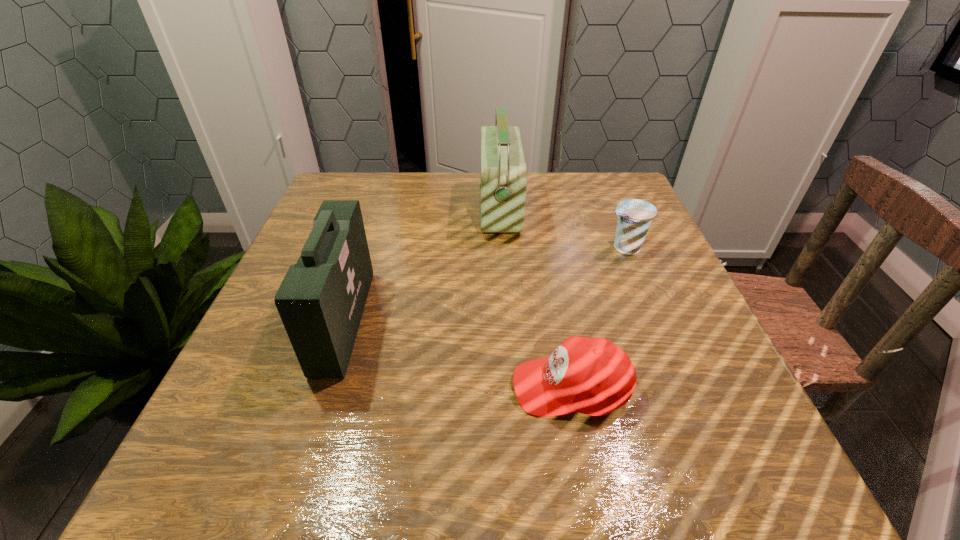
You are a GUI agent. You are given a task and a screenshot of the screen. Output one action in this format:
    pyautogui.click(x=<x>, y=<y>)
    Task: Click on the radio receiver
    
    Given the screenshot: What is the action you would take?
    pyautogui.click(x=503, y=183)

The image size is (960, 540). I want to click on the leftmost object, so click(321, 300).

The height and width of the screenshot is (540, 960). In order to click on yogurt in this screenshot , I will do point(634,215).

The height and width of the screenshot is (540, 960). In order to click on baseball cap in this screenshot , I will do `click(593, 376)`.

This screenshot has width=960, height=540. Identify the location of free spot located on the front panel of the radio receiver. (368, 210).

Locate an element on the screen. This screenshot has height=540, width=960. free space located 0.190m on the front panel of the radio receiver is located at coordinates (403, 210).

The image size is (960, 540). In order to click on vacant space located 0.080m on the front panel of the radio receiver in this screenshot , I will do `click(447, 210)`.

You are a GUI agent. You are given a task and a screenshot of the screen. Output one action in this format:
    pyautogui.click(x=<x>, y=<y>)
    Task: Click on the free space located on the front-facing side of the leftmost object
    This screenshot has height=540, width=960.
    Given the screenshot: What is the action you would take?
    pyautogui.click(x=409, y=321)

This screenshot has height=540, width=960. I want to click on blank space located 0.080m on the left of the yogurt, so click(x=568, y=248).

This screenshot has height=540, width=960. In order to click on vacant region located 0.160m on the front panel of the baseball cap in this screenshot , I will do `click(413, 387)`.